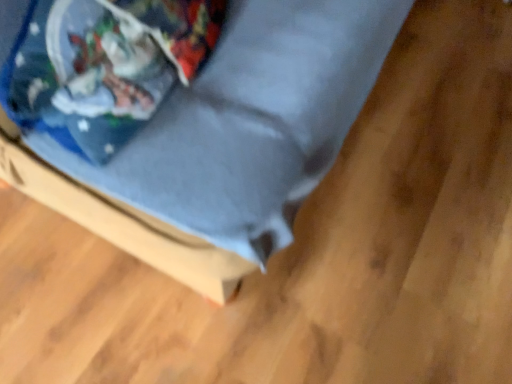
Identify the location of blue fabric bag at upper left. This screenshot has width=512, height=384. (104, 66).

This screenshot has height=384, width=512. Describe the element at coordinates (104, 66) in the screenshot. I see `blue fabric bag at upper left` at that location.

Find the location of a particular element. The height and width of the screenshot is (384, 512). matte blue cushion at center is located at coordinates (225, 146).

Describe the element at coordinates (225, 146) in the screenshot. I see `matte blue cushion at center` at that location.

Identify the location of blue fabric bag at upper left. (104, 66).

In the scene shown: Considering the relative positions of blue fabric bag at upper left and matte blue cushion at center in the image provided, is blue fabric bag at upper left to the right of matte blue cushion at center from the viewer's perspective?

No.

Is blue fabric bag at upper left positioned before matte blue cushion at center?

No, blue fabric bag at upper left is further to the viewer.

Considering the points (124, 134) and (212, 138), which point is in front, point (124, 134) or point (212, 138)?

Point (124, 134)

From the image's perspective, which object appears higher, blue fabric bag at upper left or matte blue cushion at center?

matte blue cushion at center is shown above in the image.

From a real-world perspective, does blue fabric bag at upper left stand above matte blue cushion at center?

Indeed, from a real-world perspective, blue fabric bag at upper left stands above matte blue cushion at center.

Which object is thinner, blue fabric bag at upper left or matte blue cushion at center?

Thinner between the two is blue fabric bag at upper left.

Looking at this image, considering the relative sizes of blue fabric bag at upper left and matte blue cushion at center in the image provided, is blue fabric bag at upper left shorter than matte blue cushion at center?

Correct, blue fabric bag at upper left is not as tall as matte blue cushion at center.

In the scene shown: Looking at the image, does blue fabric bag at upper left seem bigger or smaller compared to matte blue cushion at center?

In the image, blue fabric bag at upper left appears to be smaller than matte blue cushion at center.

From the picture: Does blue fabric bag at upper left contain matte blue cushion at center?

No, blue fabric bag at upper left does not contain matte blue cushion at center.

Is blue fabric bag at upper left positioned far away from matte blue cushion at center?

No, blue fabric bag at upper left is not far away from matte blue cushion at center.

Could you tell me if blue fabric bag at upper left is facing matte blue cushion at center?

Yes, blue fabric bag at upper left faces towards matte blue cushion at center.

How many degrees apart are the facing directions of blue fabric bag at upper left and matte blue cushion at center?

The facing directions of blue fabric bag at upper left and matte blue cushion at center are 1.18 degrees apart.

At what (x,y) coordinates should I click in order to perform the action: click on wrapping paper lying below the matte blue cushion at center (from the image's perspective). Please return your answer as a coordinate pair (x, y). The image size is (512, 384). Looking at the image, I should click on (104, 66).

Does matte blue cushion at center appear on the right side of blue fabric bag at upper left?

Yes.

Relative to blue fabric bag at upper left, is matte blue cushion at center in front or behind?

In the image, matte blue cushion at center appears in front of blue fabric bag at upper left.

Considering the points (42, 149) and (108, 58), which point is behind, point (42, 149) or point (108, 58)?

The point (108, 58) is farther from the camera.

From the image's perspective, is matte blue cushion at center positioned above or below blue fabric bag at upper left?

Based on their image positions, matte blue cushion at center is located above blue fabric bag at upper left.

From a real-world perspective, is matte blue cushion at center physically located above or below blue fabric bag at upper left?

matte blue cushion at center is below blue fabric bag at upper left.

In the scene shown: Can you confirm if matte blue cushion at center is thinner than blue fabric bag at upper left?

No, matte blue cushion at center is not thinner than blue fabric bag at upper left.

Which of these two, matte blue cushion at center or blue fabric bag at upper left, stands taller?

Standing taller between the two is matte blue cushion at center.

Does matte blue cushion at center have a larger size compared to blue fabric bag at upper left?

Indeed, matte blue cushion at center has a larger size compared to blue fabric bag at upper left.

Which is correct: matte blue cushion at center is inside blue fabric bag at upper left, or outside of it?

matte blue cushion at center cannot be found inside blue fabric bag at upper left.

Would you say matte blue cushion at center is a long distance from blue fabric bag at upper left?

No, matte blue cushion at center is not far away from blue fabric bag at upper left.

In the scene shown: Is matte blue cushion at center oriented towards blue fabric bag at upper left?

No.

What's the angular difference between matte blue cushion at center and blue fabric bag at upper left's facing directions?

The angular difference between matte blue cushion at center and blue fabric bag at upper left is 1.18 degrees.

This screenshot has width=512, height=384. In the image, there is a matte blue cushion at center. Identify the location of wrapping paper below it (from the image's perspective). (104, 66).

Locate an element on the screen. The image size is (512, 384). wrapping paper above the matte blue cushion at center (from a real-world perspective) is located at coordinates (104, 66).

Where is `wrapping paper on the left of matte blue cushion at center`? The width and height of the screenshot is (512, 384). wrapping paper on the left of matte blue cushion at center is located at coordinates (104, 66).